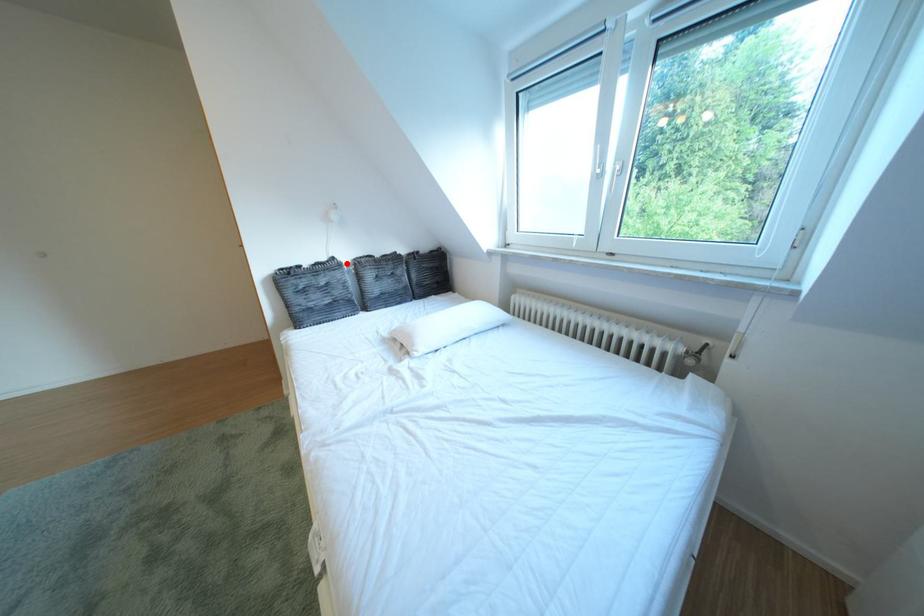
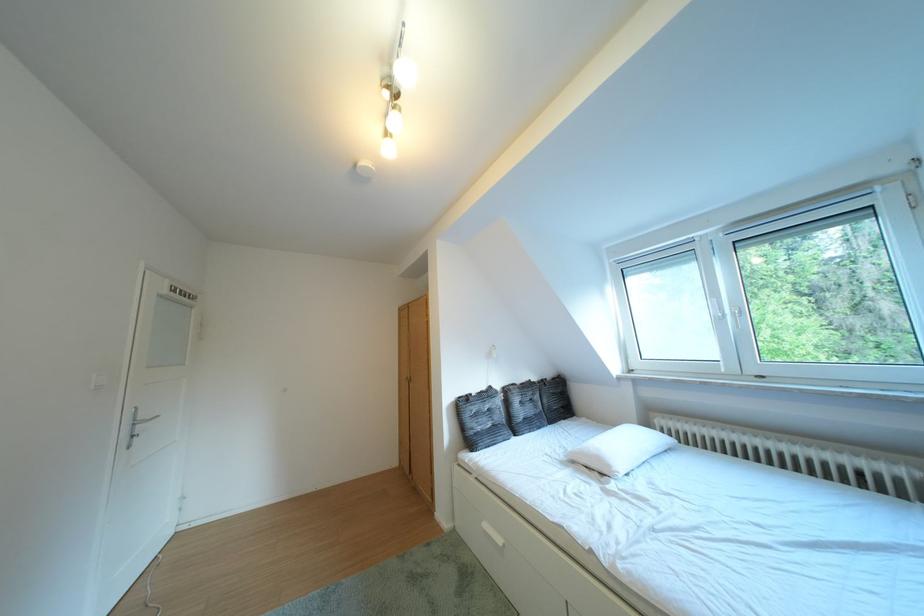
Question: I am providing you with two images of the same scene from different viewpoints. A red point is shown in image1. For the corresponding object point in image2, is it positioned nearer or farther from the camera?

Choices:
 (A) Nearer
 (B) Farther

Answer: (B)